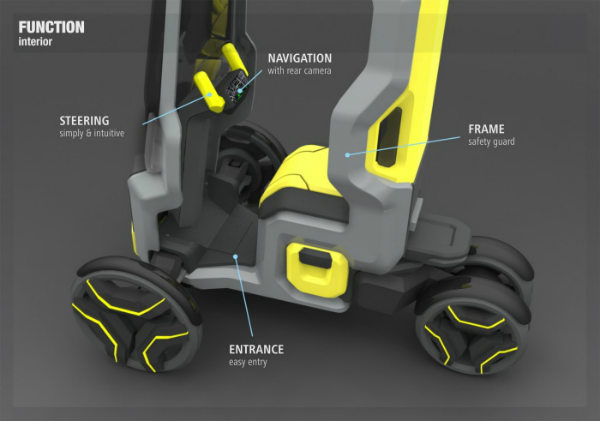
Locate an element on the screen. This screenshot has height=421, width=600. place to sit is located at coordinates (306, 167).